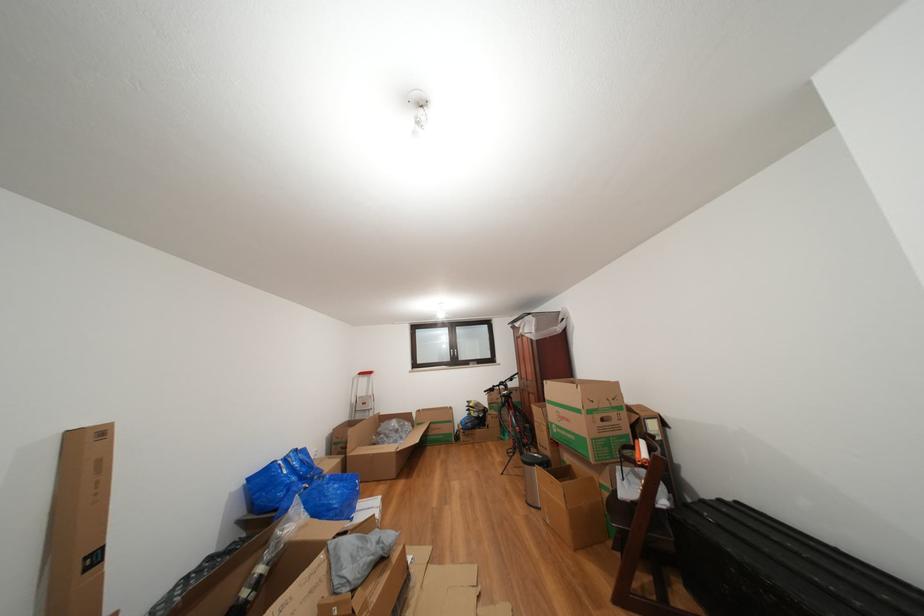
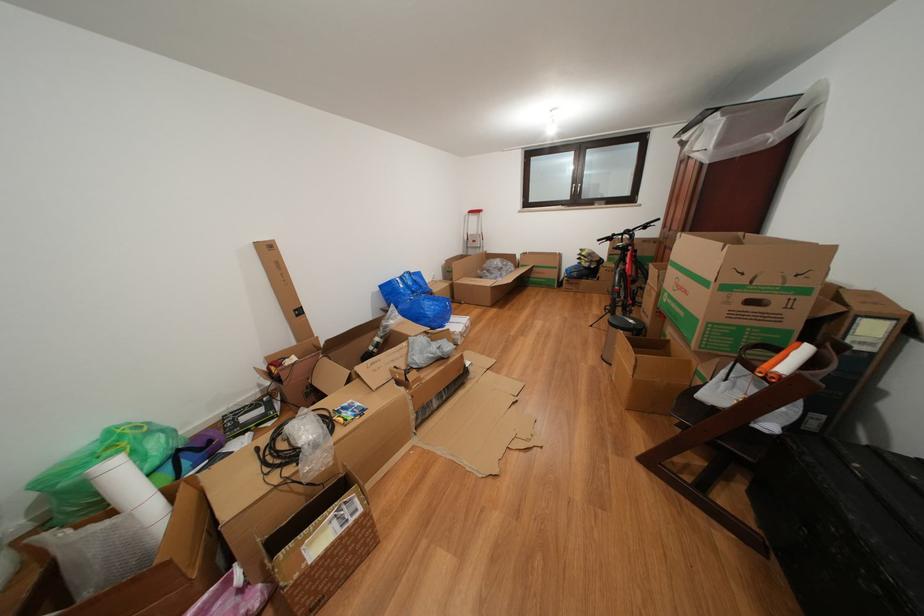
Locate, in the second image, the point that corresponds to point 503,392 in the first image.

(622, 240)